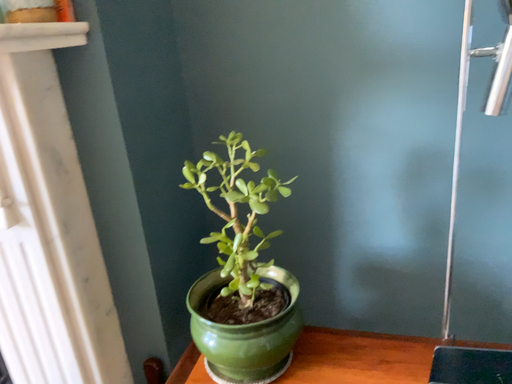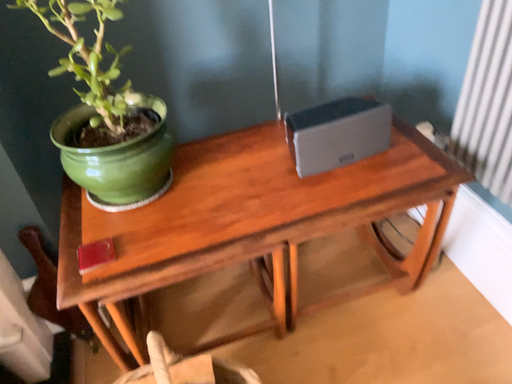
Question: Which way did the camera rotate in the video?

Choices:
 (A) rotated right
 (B) rotated left

Answer: (A)